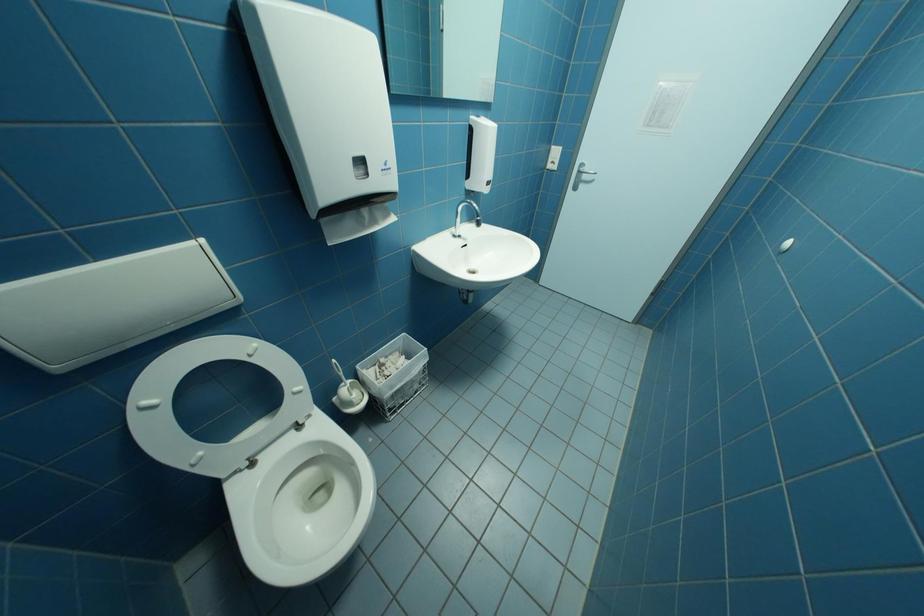
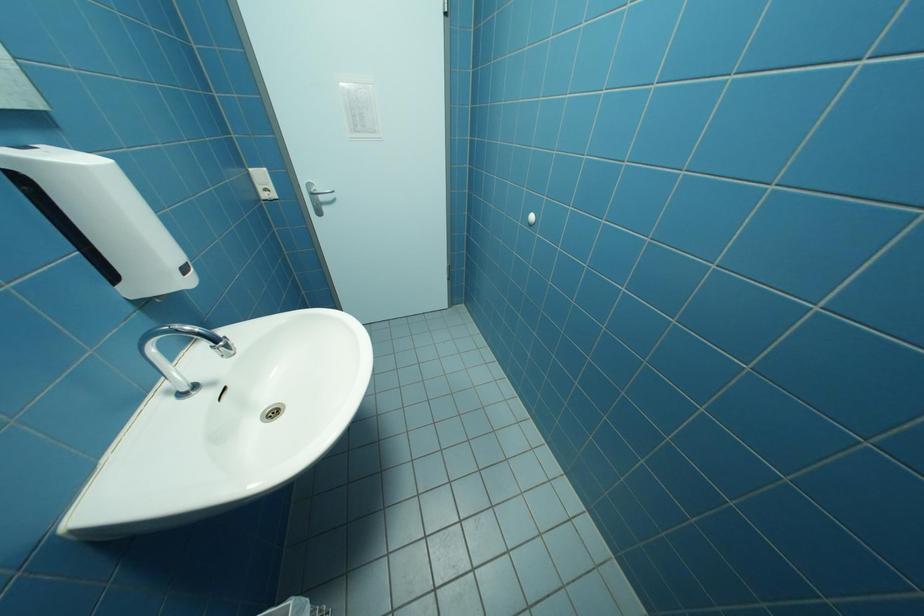
Question: The camera is either moving clockwise (left) or counter-clockwise (right) around the object. The first image is from the beginning of the video and the second image is from the end. Is the camera moving left or right when shooting the video?

Choices:
 (A) Left
 (B) Right

Answer: (A)